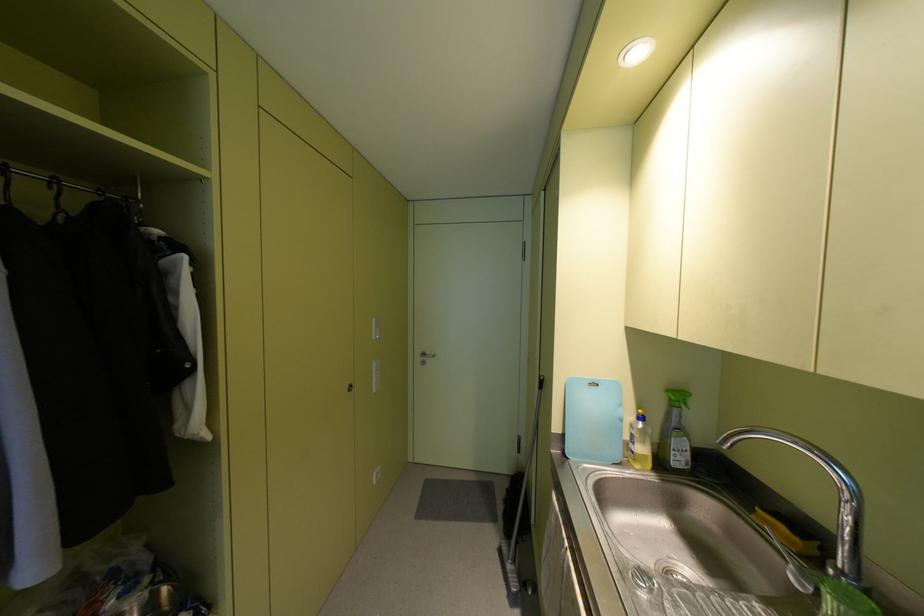
Find where to squeez the green spray bottle. Please return your answer as a coordinate pair (x, y).

(675, 432)